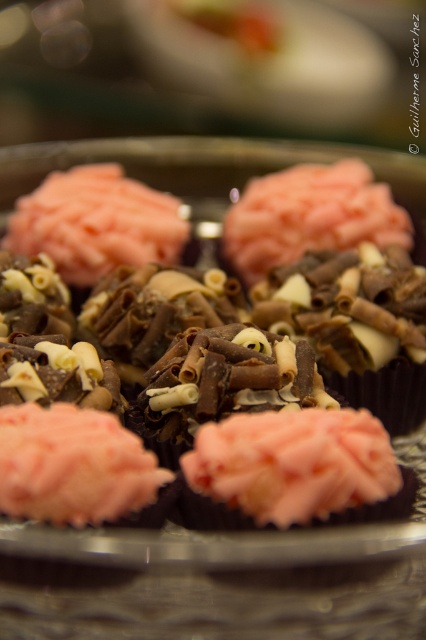
Question: Which point is closer to the camera taking this photo?

Choices:
 (A) (127, 499)
 (B) (184, 396)
 (C) (193, 486)

Answer: (A)

Question: Can you confirm if pink frosted cupcake at center is bigger than pink frosted cupcake at lower left?

Choices:
 (A) no
 (B) yes

Answer: (B)

Question: Which object is positioned farthest from the pink matte frosting at center?

Choices:
 (A) pink frosted cupcake at center
 (B) pink frosted cupcake at lower left

Answer: (B)

Question: Does pink frosted cupcake at center have a lesser width compared to pink frosted cupcake at lower left?

Choices:
 (A) no
 (B) yes

Answer: (A)

Question: Which is nearer to the pink matte frosting at center?

Choices:
 (A) pink frosted cupcake at lower left
 (B) pink frosted cupcake at center

Answer: (B)

Question: Can you confirm if pink frosted cupcake at center is positioned to the right of pink matte frosting at center?

Choices:
 (A) yes
 (B) no

Answer: (B)